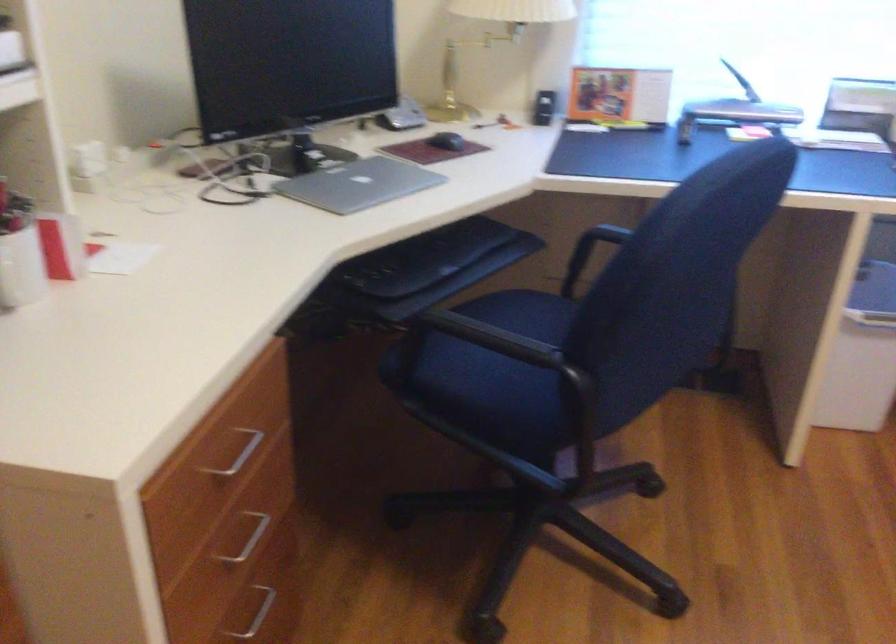
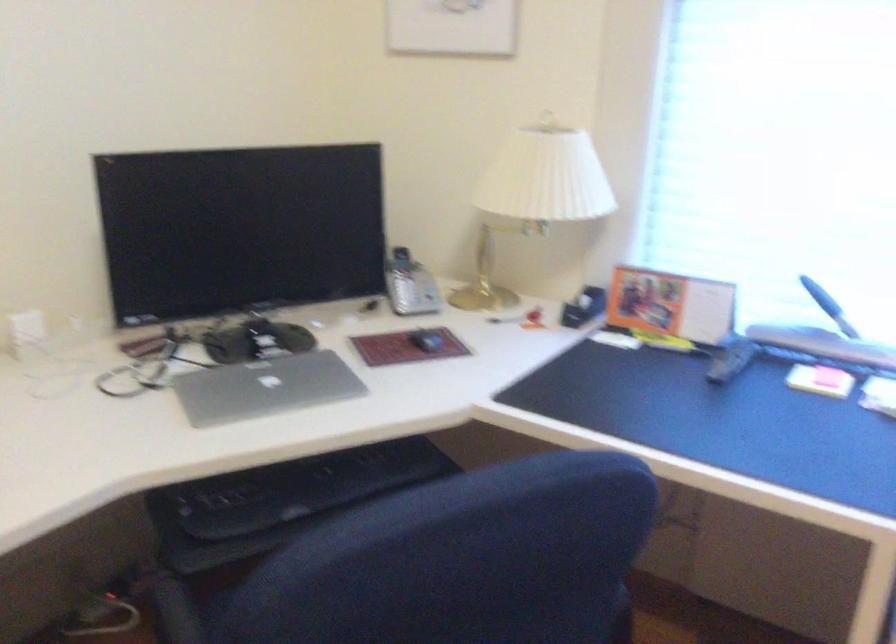
Find the pixel in the second image that matches pixel 624 93 in the first image.

(670, 305)